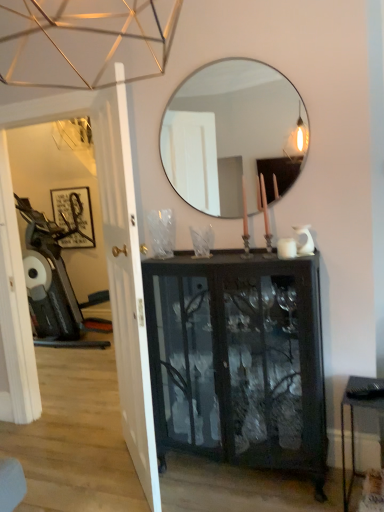
Locate an element on the screen. This screenshot has height=512, width=384. free space to the left of white glossy door at left is located at coordinates (76, 470).